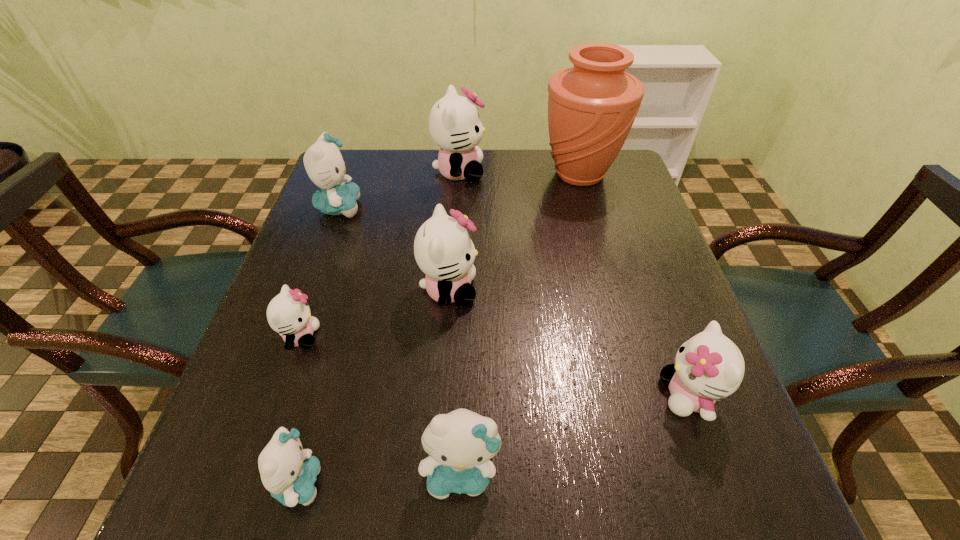
Where is `vacant space that satisfies the following two spatial constraints: 1. on the face of the rightmost blue kitten; 2. on the face of the smallest blue kitten`? This screenshot has height=540, width=960. vacant space that satisfies the following two spatial constraints: 1. on the face of the rightmost blue kitten; 2. on the face of the smallest blue kitten is located at coordinates (461, 483).

Locate an element on the screen. The height and width of the screenshot is (540, 960). vacant point that satisfies the following two spatial constraints: 1. on the front side of the tallest object; 2. on the face of the farthest blue kitten is located at coordinates (588, 207).